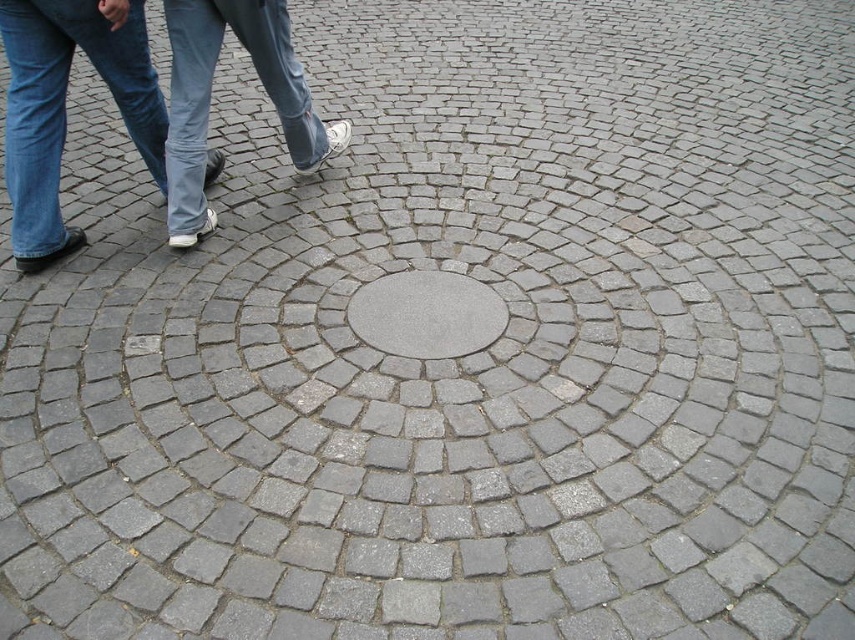
Question: Estimate the real-world distances between objects in this image. Which object is closer to the blue jeans at left?

Choices:
 (A) white canvas shoe at center
 (B) gray concrete manhole cover at center

Answer: (A)

Question: Can you confirm if blue jeans at left is positioned below gray concrete manhole cover at center?

Choices:
 (A) yes
 (B) no

Answer: (B)

Question: Is blue jeans at left smaller than gray concrete manhole cover at center?

Choices:
 (A) no
 (B) yes

Answer: (A)

Question: Does blue jeans at left appear on the right side of white canvas shoe at center?

Choices:
 (A) yes
 (B) no

Answer: (B)

Question: Which point is closer to the camera?

Choices:
 (A) (220, 168)
 (B) (463, 339)
 (C) (175, 140)

Answer: (B)

Question: Which of the following is the closest to the observer?

Choices:
 (A) (57, 138)
 (B) (272, 84)
 (C) (413, 276)

Answer: (A)